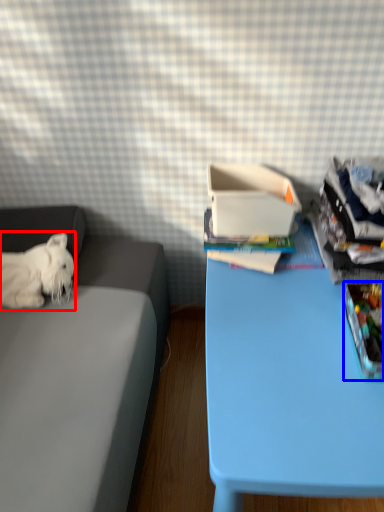
Question: Among these objects, which one is farthest to the camera, dog (highlighted by a red box) or storage box (highlighted by a blue box)?

Choices:
 (A) dog
 (B) storage box

Answer: (A)